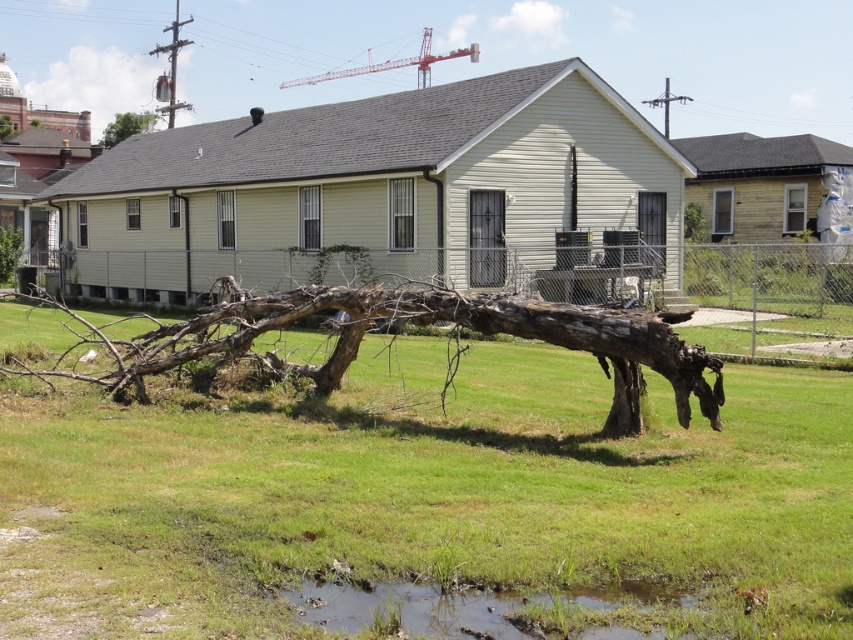
Between wooden fence at center and muddy wet grass at lower center, which one has more height?

wooden fence at center

Consider the image. Is wooden fence at center above muddy wet grass at lower center?

Yes.

The image size is (853, 640). I want to click on wooden fence at center, so click(x=572, y=273).

Does brown rough tree trunk at lower left have a smaller size compared to brown rough tree trunk at upper left?

Yes.

Can you confirm if brown rough tree trunk at lower left is shorter than brown rough tree trunk at upper left?

Correct, brown rough tree trunk at lower left is not as tall as brown rough tree trunk at upper left.

At what (x,y) coordinates should I click in order to perform the action: click on brown rough tree trunk at lower left. Please return your answer as a coordinate pair (x, y). The height and width of the screenshot is (640, 853). Looking at the image, I should click on (9, 252).

What are the coordinates of `brown rough tree trunk at lower left` in the screenshot? It's located at (9, 252).

Is brown rough tree trunk at lower center further to the viewer compared to wooden fence at center?

No, brown rough tree trunk at lower center is in front of wooden fence at center.

Is point (291, 464) closer to viewer compared to point (677, 304)?

Yes, point (291, 464) is in front of point (677, 304).

You are a GUI agent. You are given a task and a screenshot of the screen. Output one action in this format:
    pyautogui.click(x=<x>, y=<y>)
    Task: Click on the brown rough tree trunk at lower center
    The height and width of the screenshot is (640, 853).
    Given the screenshot: What is the action you would take?
    pyautogui.click(x=421, y=492)